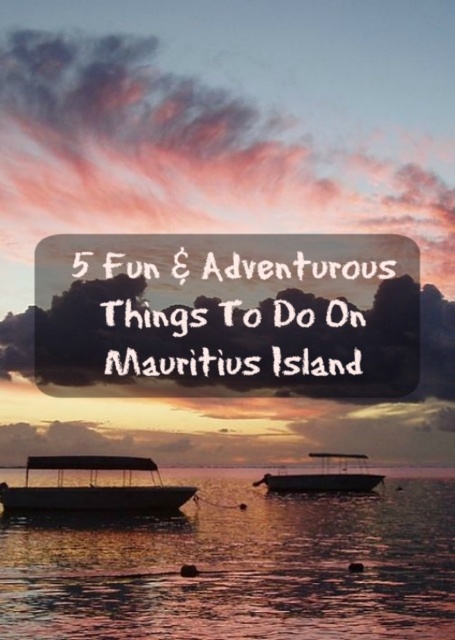
Based on the photo, you are a passenger on the matte black boat at lower left and want to take a photo of the sunset. Since the other boat is nearby, will the matte black boat at center block your view of the sunset? Please explain based on their heights.

The matte black boat at lower left has a lesser height compared to the matte black boat at center. Since the center boat is taller, it might block your view of the sunset if positioned between you and the horizon. Adjust your position to ensure the taller boat isn not obstructing your line of sight.

You are standing on the shore and see the translucent water at center and the matte black boat at lower left. Which object is closer to the water surface?

The matte black boat at lower left is closer to the water surface because the translucent water at center is located below it.